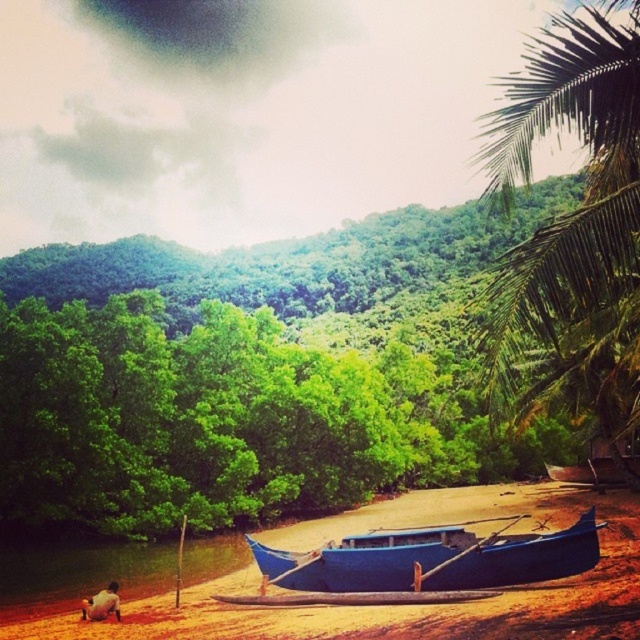
Question: Which object is the farthest from the blue wooden canoe at center?

Choices:
 (A) blue wooden boat at lower center
 (B) brown leather bag at lower left
 (C) green leafy palm tree at right
 (D) blue polished wood boat at center

Answer: (C)

Question: Estimate the real-world distances between objects in this image. Which object is farther from the green leafy palm tree at right?

Choices:
 (A) brown leather bag at lower left
 (B) blue wooden boat at lower center

Answer: (A)

Question: Estimate the real-world distances between objects in this image. Which object is farther from the blue wooden boat at lower center?

Choices:
 (A) blue polished wood boat at center
 (B) blue wooden canoe at center
 (C) brown leather bag at lower left
 (D) green leafy palm tree at right

Answer: (D)

Question: Does blue polished wood boat at center have a lesser width compared to blue wooden canoe at center?

Choices:
 (A) no
 (B) yes

Answer: (A)

Question: Observing the image, what is the correct spatial positioning of green leafy palm tree at right in reference to brown leather bag at lower left?

Choices:
 (A) below
 (B) above

Answer: (B)

Question: Is green leafy palm tree at right to the right of brown leather bag at lower left from the viewer's perspective?

Choices:
 (A) yes
 (B) no

Answer: (A)